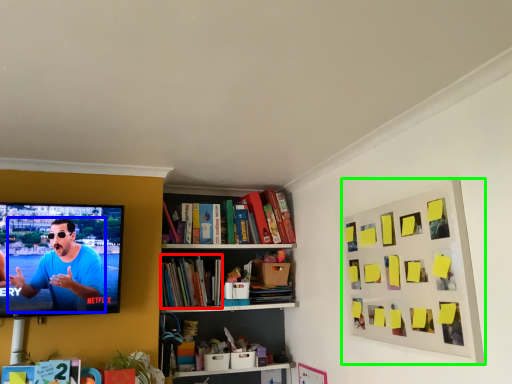
Question: Considering the real-world distances, which object is closest to book (highlighted by a red box)? person (highlighted by a blue box) or picture frame (highlighted by a green box).

Choices:
 (A) person
 (B) picture frame

Answer: (A)